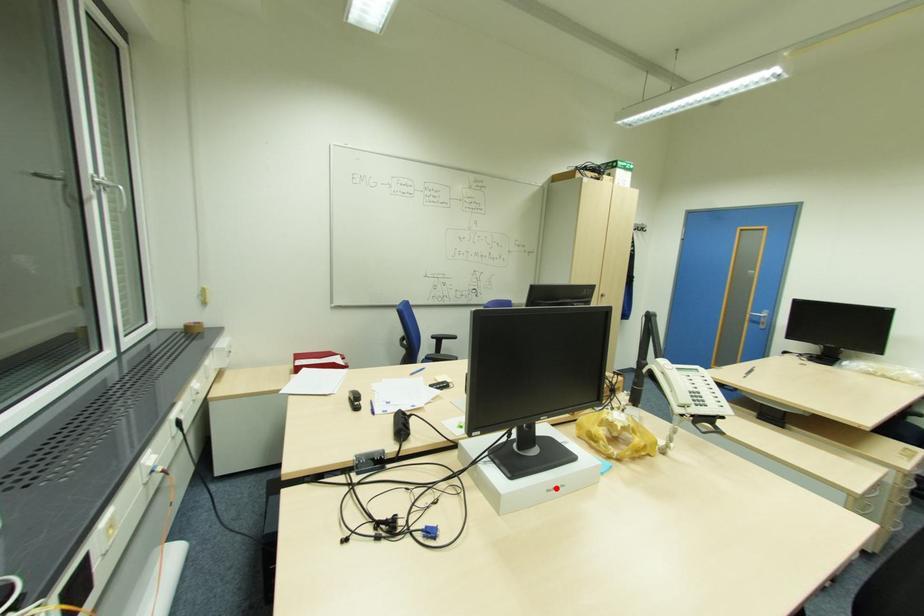
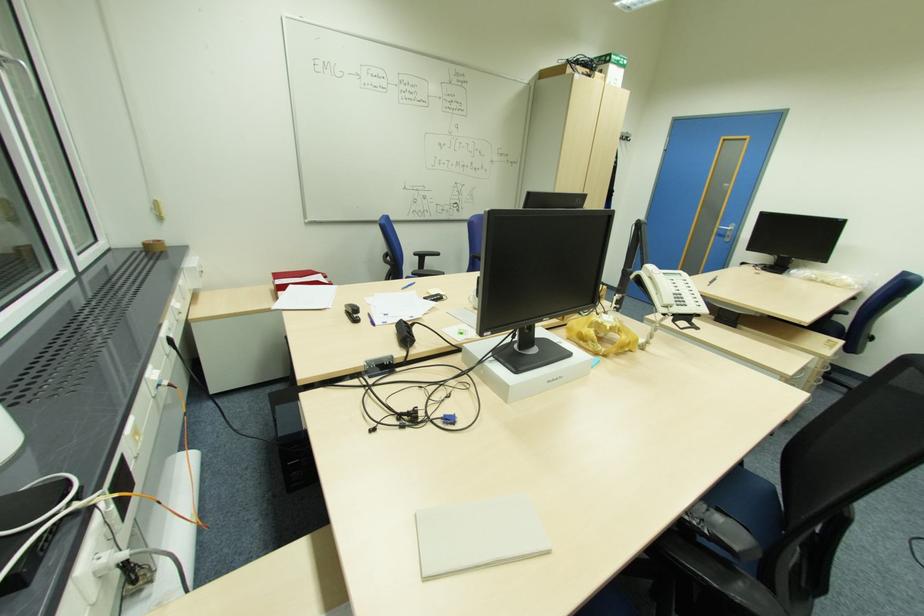
The point at the highlighted location is marked in the first image. Where is the corresponding point in the second image?

(555, 379)